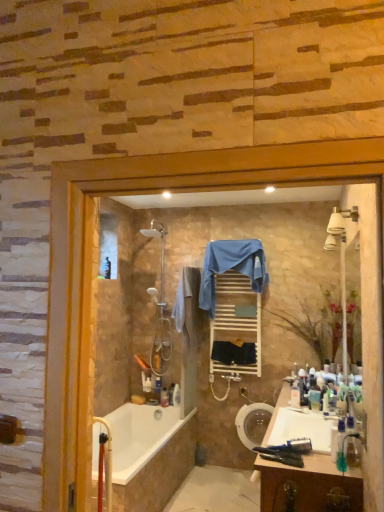
I want to click on free point below blue fabric towel at center, which ranks as the 2th bath towel in right-to-left order (from a real-world perspective), so click(x=223, y=475).